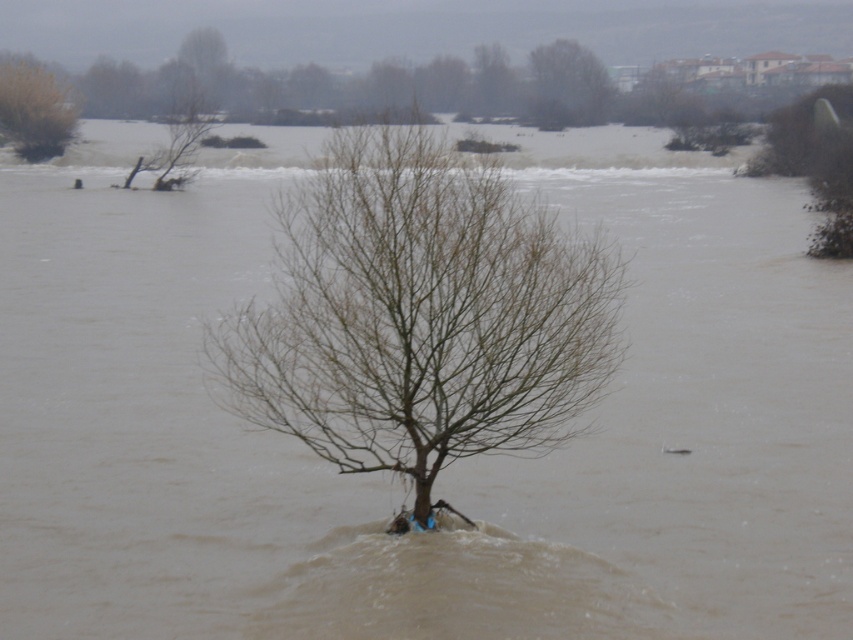
Question: Which point is farther to the camera?

Choices:
 (A) (35, 144)
 (B) (416, 456)

Answer: (A)

Question: Observing the image, what is the correct spatial positioning of brown leafless tree at upper left in reference to bare branches at upper center?

Choices:
 (A) below
 (B) above

Answer: (A)

Question: Which of the following is the closest to the observer?

Choices:
 (A) (463, 268)
 (B) (0, 113)

Answer: (A)

Question: Does brown leafless tree at upper left have a larger size compared to bare branches at upper center?

Choices:
 (A) yes
 (B) no

Answer: (B)

Question: Which of the following is the closest to the observer?

Choices:
 (A) brown matte tree at center
 (B) brown leafless tree at upper left
 (C) bare branches at upper center

Answer: (A)

Question: From the image, what is the correct spatial relationship of brown matte tree at center in relation to brown leafless tree at upper left?

Choices:
 (A) above
 (B) below

Answer: (B)